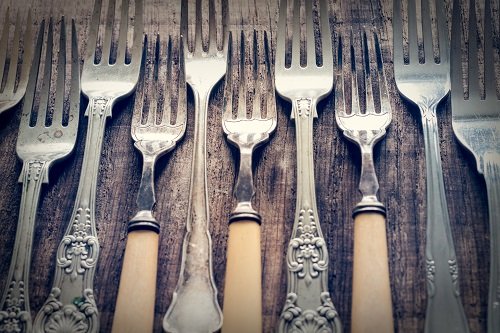
Identify the location of 10 forks. The width and height of the screenshot is (500, 333). (489, 125), (436, 84), (374, 131), (307, 83), (256, 134), (206, 67), (161, 134), (125, 73), (50, 140), (14, 79).